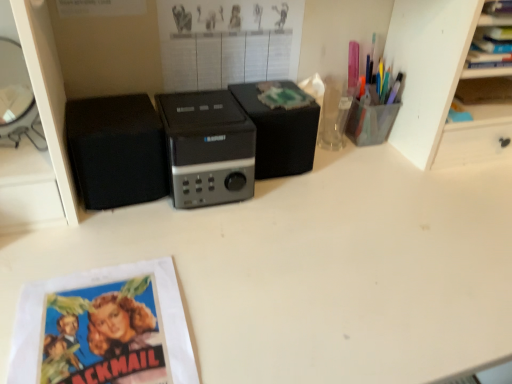
Question: From the image's perspective, is black matte speaker at center, arranged as the second speaker when viewed from the left, positioned above or below translucent plastic pen holder at upper right?

Choices:
 (A) below
 (B) above

Answer: (A)

Question: Considering the relative positions of black matte speaker at center, the 1th speaker when ordered from right to left, and translucent plastic pen holder at upper right in the image provided, is black matte speaker at center, the 1th speaker when ordered from right to left, to the left or to the right of translucent plastic pen holder at upper right?

Choices:
 (A) left
 (B) right

Answer: (A)

Question: Which object is the closest to the black plastic speaker at center?

Choices:
 (A) blue paper at lower left
 (B) matte black poster at upper center
 (C) black matte speaker at left, positioned as the 2th speaker in right-to-left order
 (D) translucent plastic pen holder at upper right
 (E) black matte speaker at center, arranged as the second speaker when viewed from the left

Answer: (E)

Question: Estimate the real-world distances between objects in this image. Which object is farther from the black plastic speaker at center?

Choices:
 (A) translucent plastic pen holder at upper right
 (B) matte black poster at upper center
 (C) blue paper at lower left
 (D) black matte speaker at left, positioned as the 2th speaker in right-to-left order
 (E) black matte speaker at center, the 1th speaker when ordered from right to left

Answer: (A)